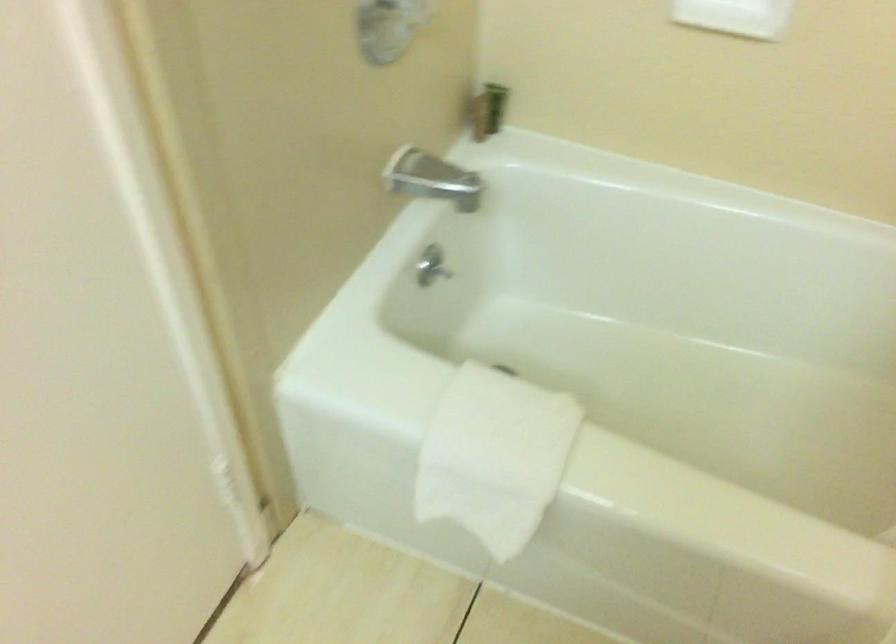
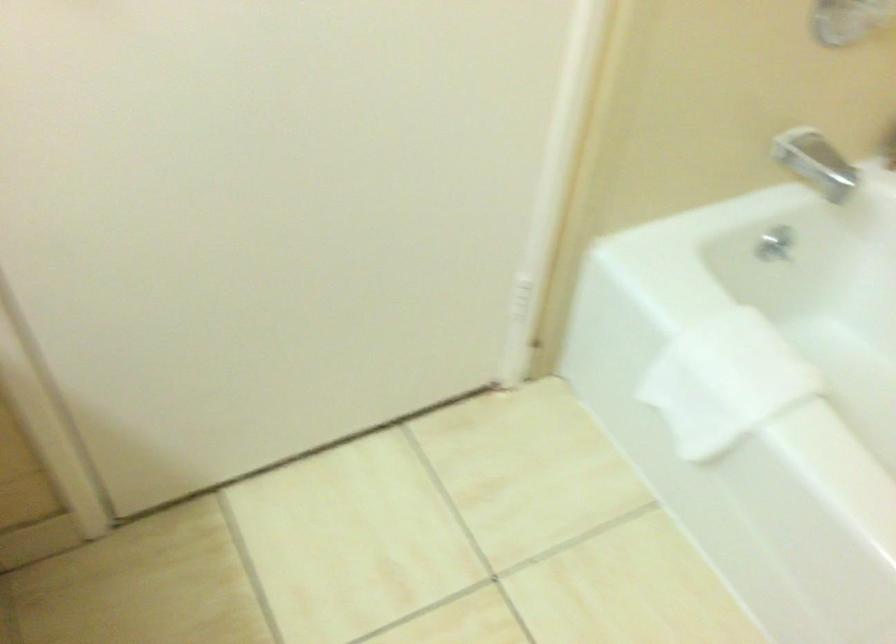
Question: The images are taken continuously from a first-person perspective. In which direction is your viewpoint rotating?

Choices:
 (A) Left
 (B) Right
 (C) Up
 (D) Down

Answer: (A)